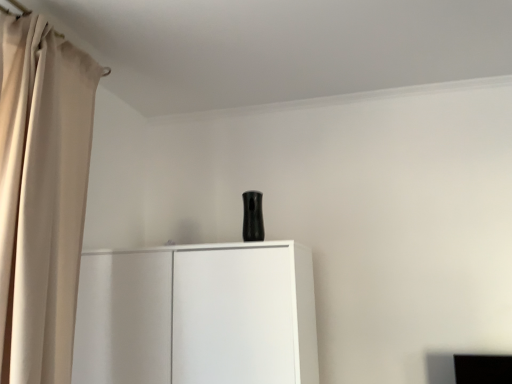
Question: From a real-world perspective, is white matte cupboard at center positioned above or below beige fabric curtain at left?

Choices:
 (A) below
 (B) above

Answer: (A)

Question: Considering the positions of white matte cupboard at center and beige fabric curtain at left in the image, is white matte cupboard at center taller or shorter than beige fabric curtain at left?

Choices:
 (A) short
 (B) tall

Answer: (A)

Question: Is white matte cupboard at center inside the boundaries of beige fabric curtain at left, or outside?

Choices:
 (A) inside
 (B) outside

Answer: (B)

Question: Do you think beige fabric curtain at left is within white matte cupboard at center, or outside of it?

Choices:
 (A) outside
 (B) inside

Answer: (A)

Question: Considering the positions of point (10, 109) and point (173, 254), is point (10, 109) closer or farther from the camera than point (173, 254)?

Choices:
 (A) farther
 (B) closer

Answer: (B)

Question: In terms of size, does beige fabric curtain at left appear bigger or smaller than white matte cupboard at center?

Choices:
 (A) big
 (B) small

Answer: (B)

Question: From their relative heights in the image, would you say beige fabric curtain at left is taller or shorter than white matte cupboard at center?

Choices:
 (A) tall
 (B) short

Answer: (A)